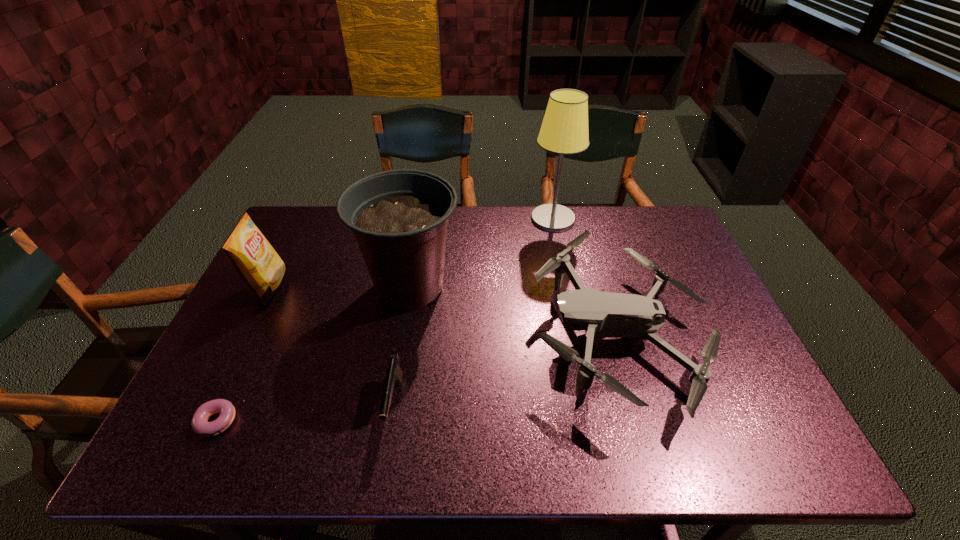
The height and width of the screenshot is (540, 960). In order to click on object positioned at the right edge in this screenshot , I will do `click(601, 315)`.

Where is `object located at the near left corner`? Image resolution: width=960 pixels, height=540 pixels. object located at the near left corner is located at coordinates (200, 426).

Identify the location of object present at the near right corner. (601, 315).

Identify the location of free space at the far edge of the desktop. The image size is (960, 540). (340, 246).

Find the location of a particular element. vacant space at the near edge is located at coordinates (261, 423).

In the image, there is a desktop. Where is `vacant region at the left edge`? vacant region at the left edge is located at coordinates (257, 344).

The width and height of the screenshot is (960, 540). What are the coordinates of `vacant space at the right edge of the desktop` in the screenshot? It's located at (715, 411).

In order to click on vacant position at the near left corner of the desktop in this screenshot , I will do `click(183, 463)`.

This screenshot has width=960, height=540. What are the coordinates of `free space at the far right corner of the desktop` in the screenshot? It's located at (676, 242).

The width and height of the screenshot is (960, 540). Find the location of `empty space that is in between the doughnut and the third shortest object`. empty space that is in between the doughnut and the third shortest object is located at coordinates pos(417,378).